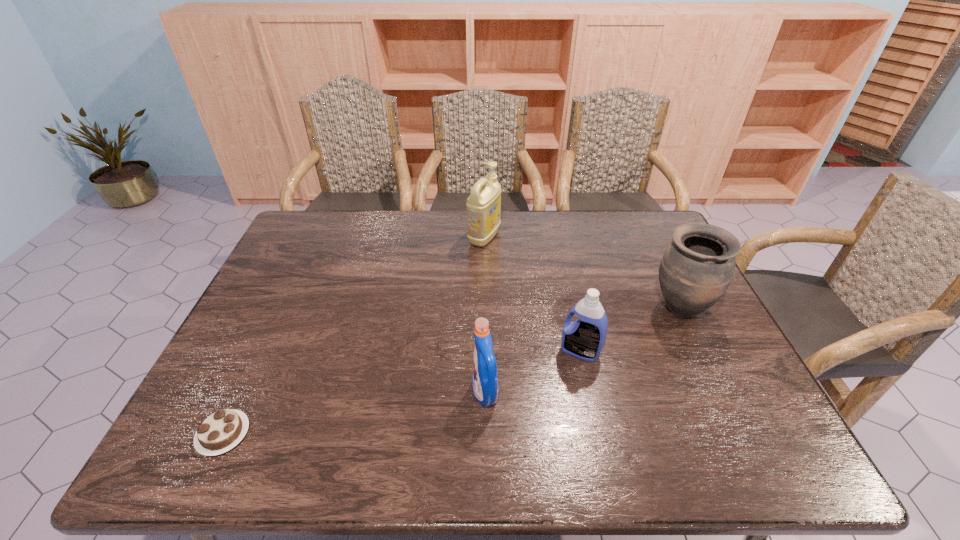
Find the location of a particular element. free point located on the left of the urn is located at coordinates (545, 309).

Find the location of a particular element. Image resolution: width=960 pixels, height=540 pixels. vacant space located on the left of the second farthest detergent is located at coordinates (525, 351).

Identify the location of blank space located 0.060m on the label of the nearest detergent. (446, 393).

This screenshot has width=960, height=540. I want to click on free space located 0.190m on the label of the nearest detergent, so click(391, 393).

Find the location of a particular element. The height and width of the screenshot is (540, 960). vacant space located 0.200m on the label of the nearest detergent is located at coordinates (387, 393).

Locate an element on the screen. This screenshot has width=960, height=540. free space located on the right of the shortest object is located at coordinates (314, 434).

I want to click on object that is at the far edge, so click(x=483, y=205).

Identify the location of object at the near edge. (224, 429).

Image resolution: width=960 pixels, height=540 pixels. In order to click on object that is at the left edge in this screenshot , I will do `click(224, 429)`.

Image resolution: width=960 pixels, height=540 pixels. Find the location of `object that is at the right edge`. object that is at the right edge is located at coordinates (697, 267).